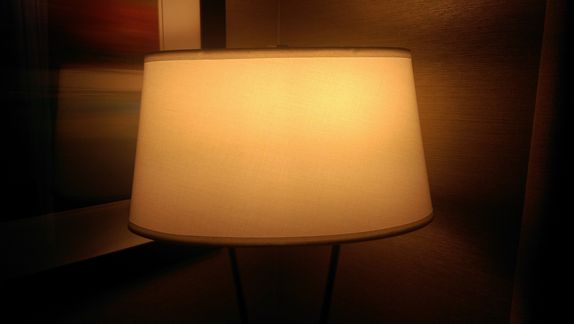
Locate an element on the screen. The height and width of the screenshot is (324, 574). wall is located at coordinates (290, 30).